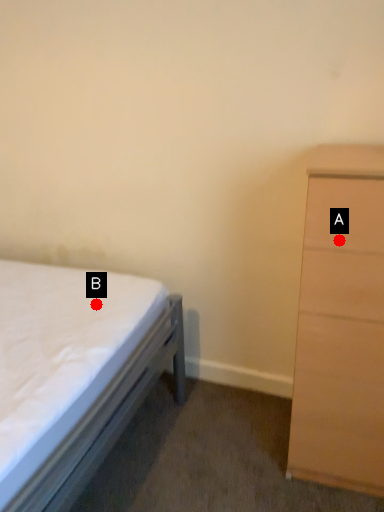
Question: Two points are circled on the image, labeled by A and B beside each circle. Which point is further to the camera?

Choices:
 (A) A is further
 (B) B is further

Answer: (B)